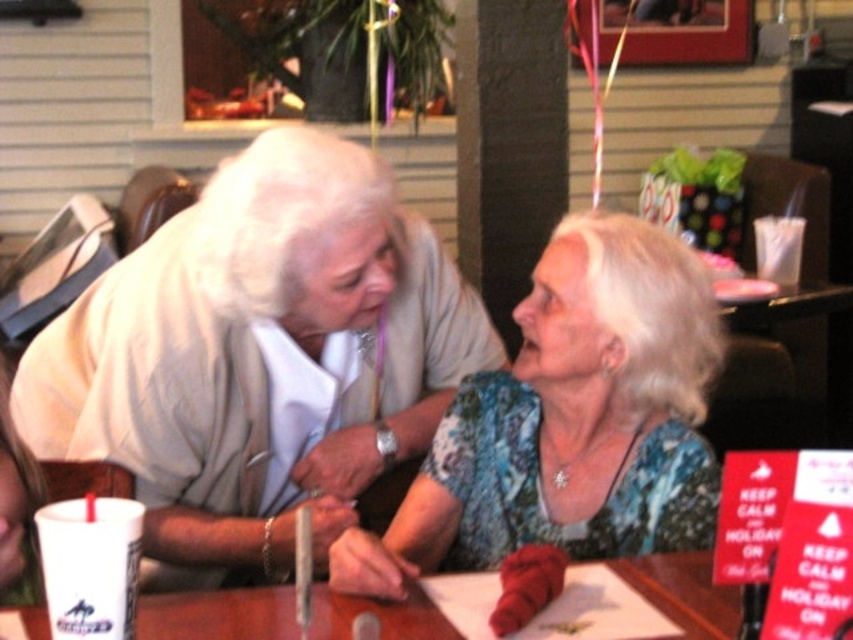
Question: Is matte white blouse at center positioned before brown wooden table at center?

Choices:
 (A) yes
 (B) no

Answer: (B)

Question: Observing the image, what is the correct spatial positioning of matte white blouse at center in reference to floral-patterned blouse at center?

Choices:
 (A) left
 (B) right

Answer: (A)

Question: Which is farther from the matte white blouse at center?

Choices:
 (A) floral-patterned blouse at center
 (B) brown wooden table at center

Answer: (B)

Question: Among these objects, which one is nearest to the camera?

Choices:
 (A) floral-patterned blouse at center
 (B) brown wooden table at center
 (C) matte white blouse at center

Answer: (B)

Question: Which point is closer to the camera?

Choices:
 (A) (601, 225)
 (B) (248, 442)
 (C) (699, 605)

Answer: (C)

Question: Is matte white blouse at center behind brown wooden table at center?

Choices:
 (A) yes
 (B) no

Answer: (A)